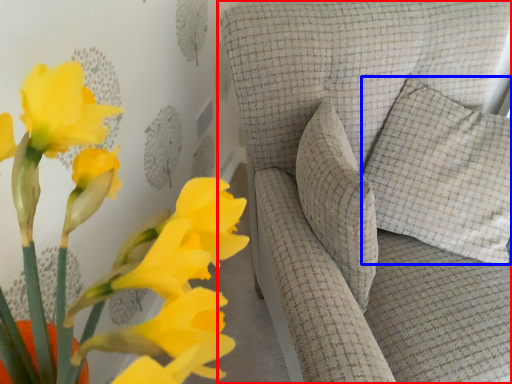
Question: Which of the following is the farthest to the observer, furniture (highlighted by a red box) or pillow (highlighted by a blue box)?

Choices:
 (A) furniture
 (B) pillow

Answer: (B)